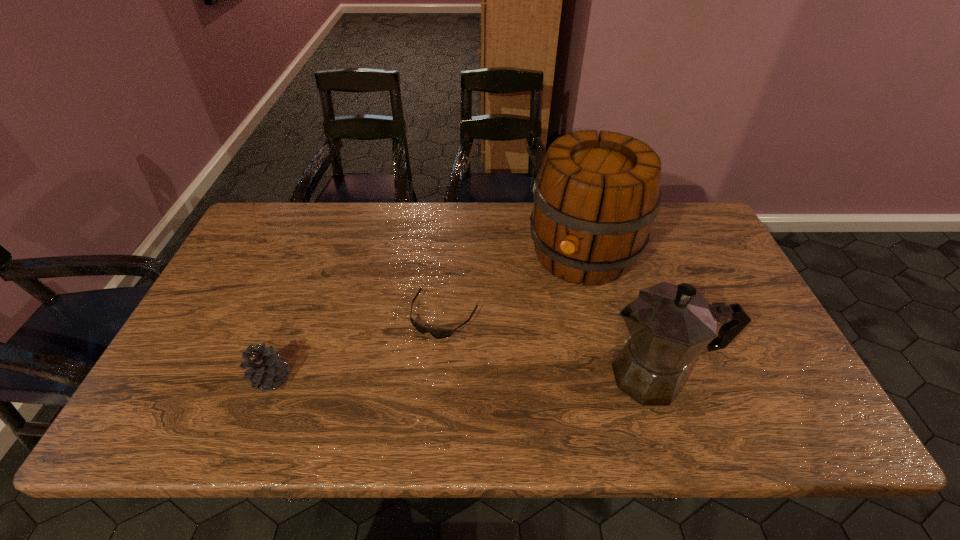
I want to click on blank area located 0.350m on the side of the cider where the spigot is located, so click(x=509, y=387).

Identify the location of free space located on the side of the cider where the spigot is located. point(508,390).

This screenshot has height=540, width=960. I want to click on free location located 0.090m on the side of the cider where the spigot is located, so click(551, 312).

I want to click on blank space located 0.150m on the front-facing side of the sunglasses, so click(x=401, y=386).

This screenshot has height=540, width=960. In order to click on vacant space located 0.150m on the front-facing side of the sunglasses in this screenshot , I will do `click(401, 386)`.

The image size is (960, 540). I want to click on vacant space located on the front-facing side of the sunglasses, so click(410, 372).

The image size is (960, 540). I want to click on object at the far edge, so click(595, 198).

Where is `pinecone located in the near edge section of the desktop`? The image size is (960, 540). pinecone located in the near edge section of the desktop is located at coordinates (266, 370).

In order to click on coffeepot located in the near edge section of the desktop in this screenshot , I will do `click(670, 325)`.

I want to click on free region at the far edge of the desktop, so click(350, 218).